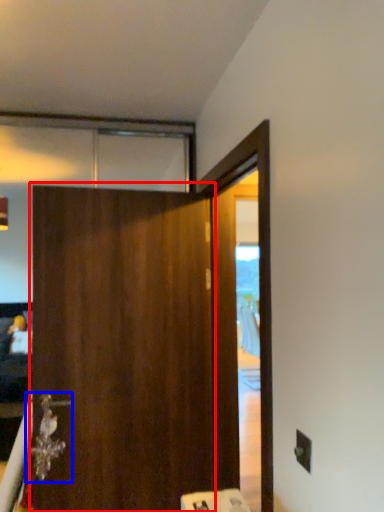
Question: Which of the following is the farthest to the observer, barn door (highlighted by a red box) or door handle (highlighted by a blue box)?

Choices:
 (A) barn door
 (B) door handle

Answer: (B)